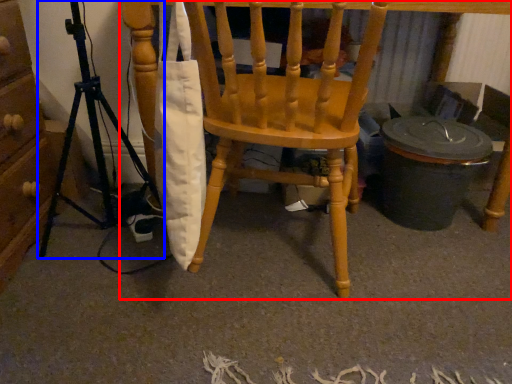
Question: Which object appears farthest to the camera in this image, chair (highlighted by a red box) or tripod (highlighted by a blue box)?

Choices:
 (A) chair
 (B) tripod

Answer: (A)